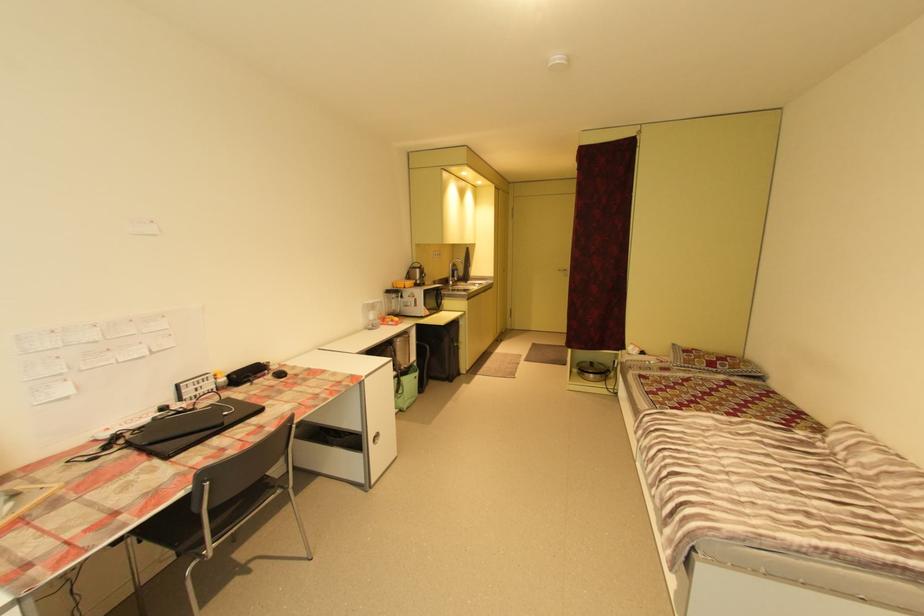
Where would you lift the light green bag? Please return your answer as a coordinate pair (x, y).

(406, 387)